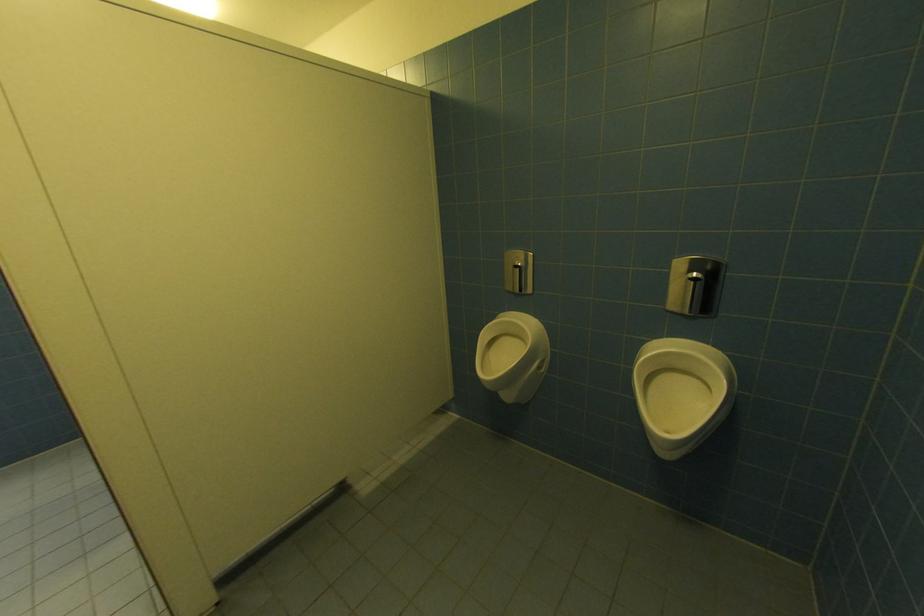
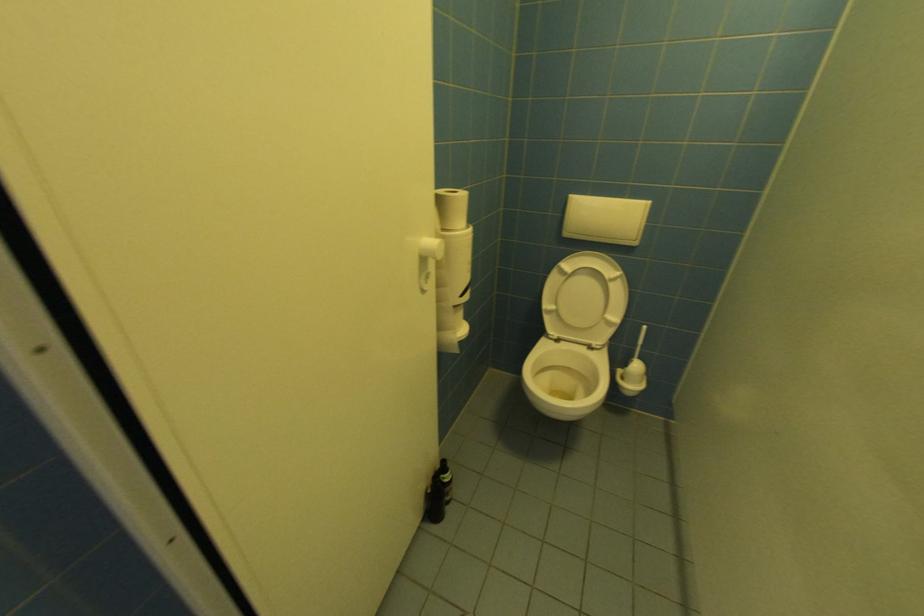
Which direction would the cameraman need to move to produce the second image?

The cameraman moved toward left, forward.